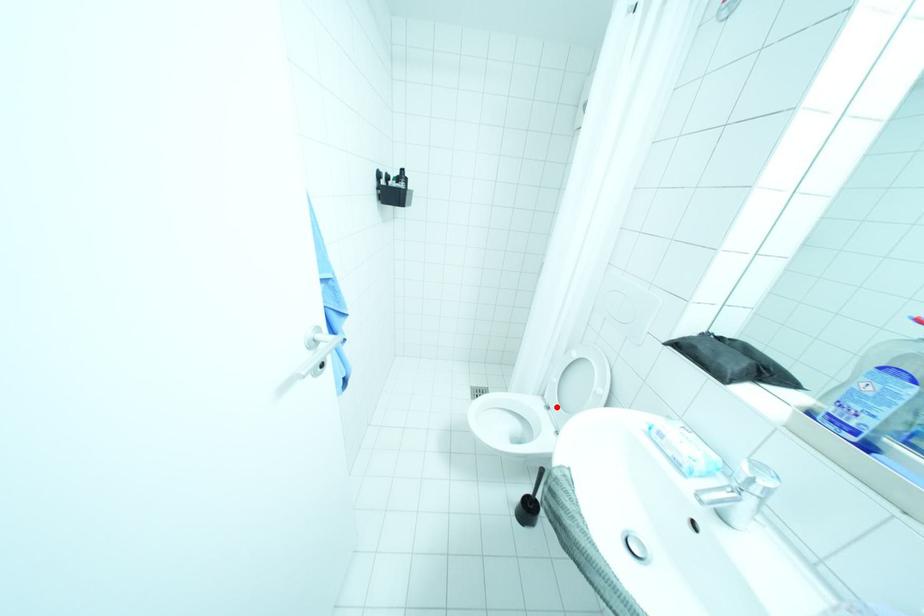
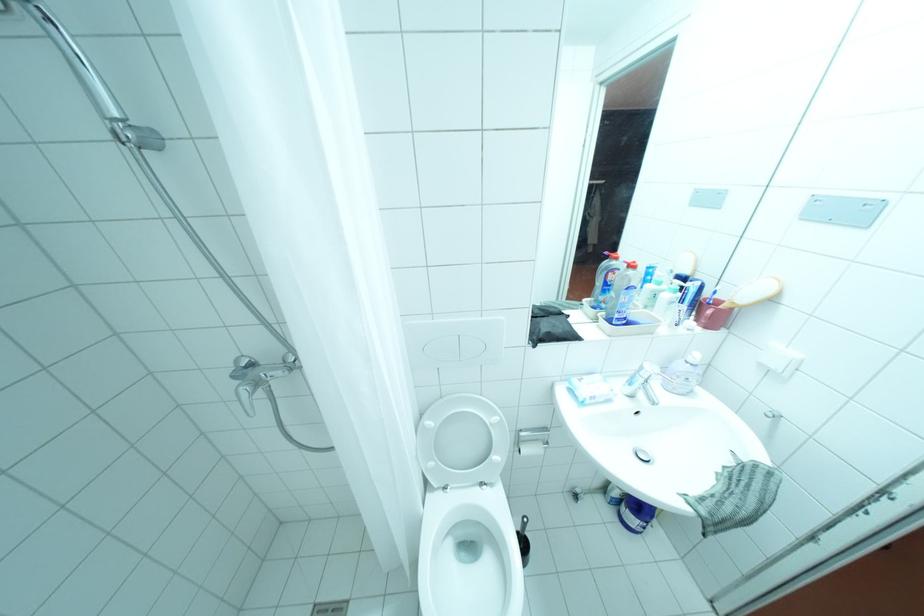
Question: A red point is marked in image1. In image2, is the corresponding 3D point closer to the camera or farther? Reply with the corresponding letter.

Choices:
 (A) The corresponding 3D point is closer.
 (B) The corresponding 3D point is farther.

Answer: (B)